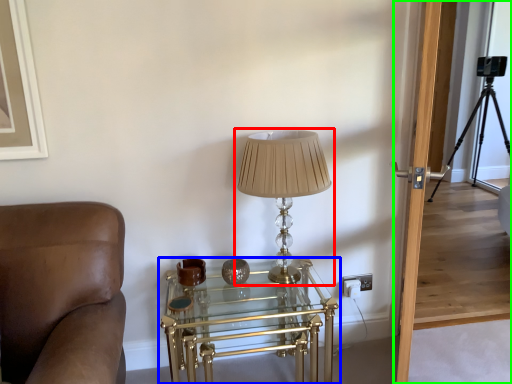
Question: Considering the real-world distances, which object is closest to lamp (highlighted by a red box)? table (highlighted by a blue box) or glass door (highlighted by a green box).

Choices:
 (A) table
 (B) glass door

Answer: (B)